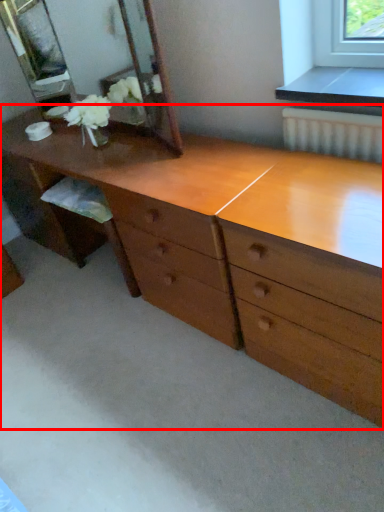
Question: From the image's perspective, considering the relative positions of chest of drawers (annotated by the red box) and mirror in the image provided, where is chest of drawers (annotated by the red box) located with respect to the staircase?

Choices:
 (A) above
 (B) below

Answer: (B)